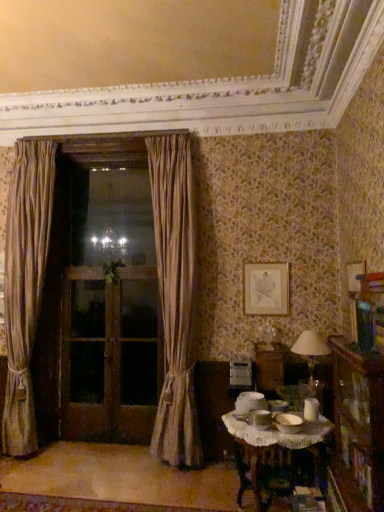
This screenshot has height=512, width=384. Identify the location of free space above brown wooden screen door at center, the 3th screen door from the left (from a real-world perspective). (140, 270).